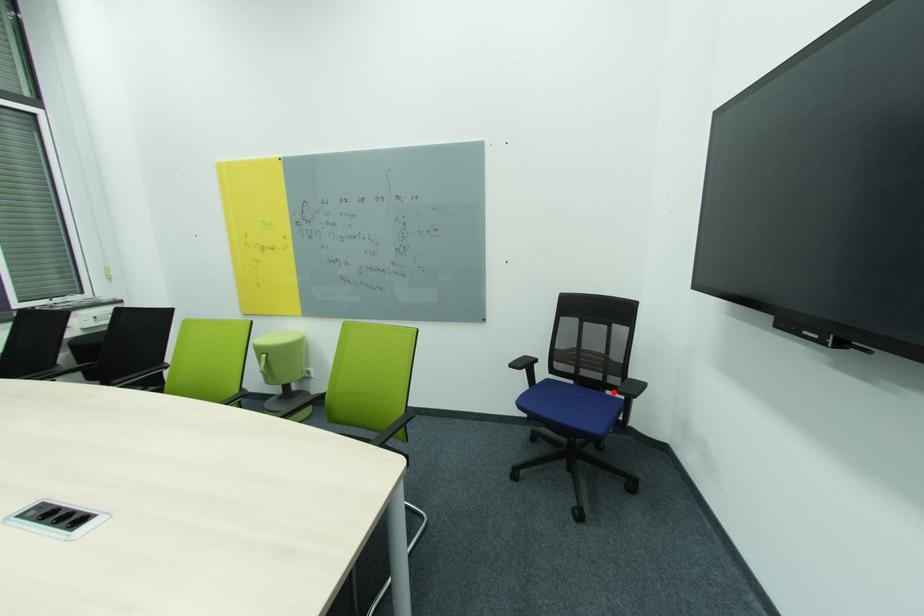
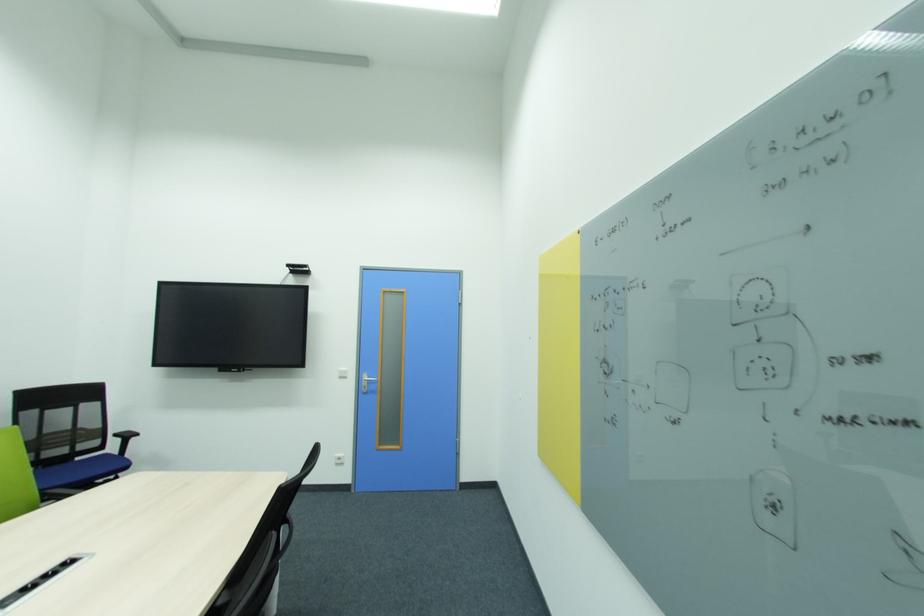
Question: I am providing you with two images of the same scene from different viewpoints. In image1, a red point is highlighted. Considering the same 3D point in image2, which of the following is correct?

Choices:
 (A) It is closer
 (B) It is farther

Answer: (B)